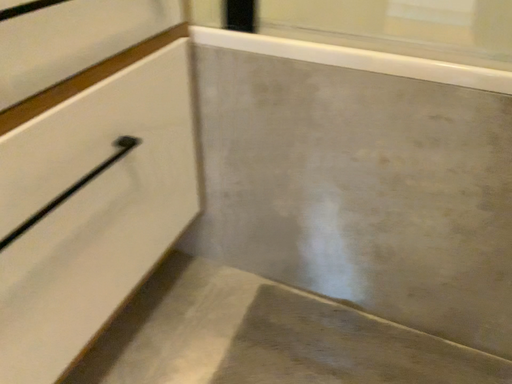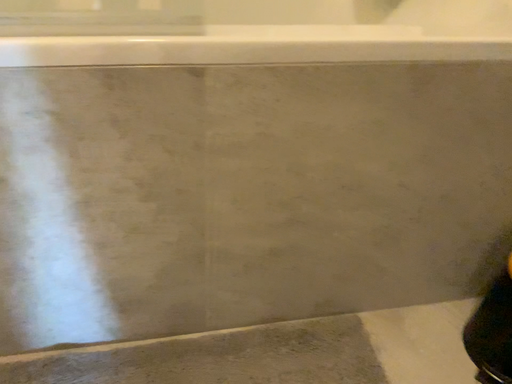
Question: How did the camera likely rotate when shooting the video?

Choices:
 (A) rotated left
 (B) rotated right

Answer: (B)